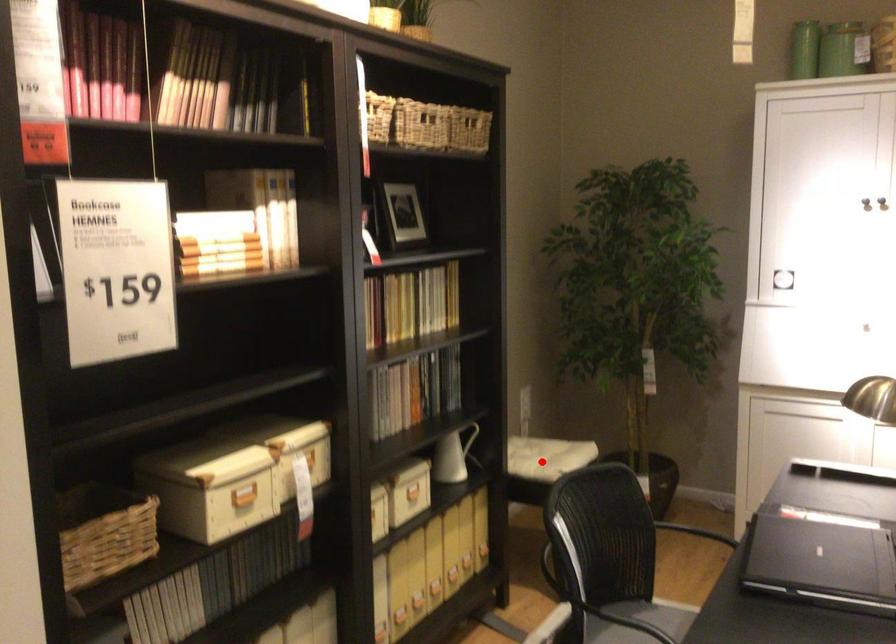
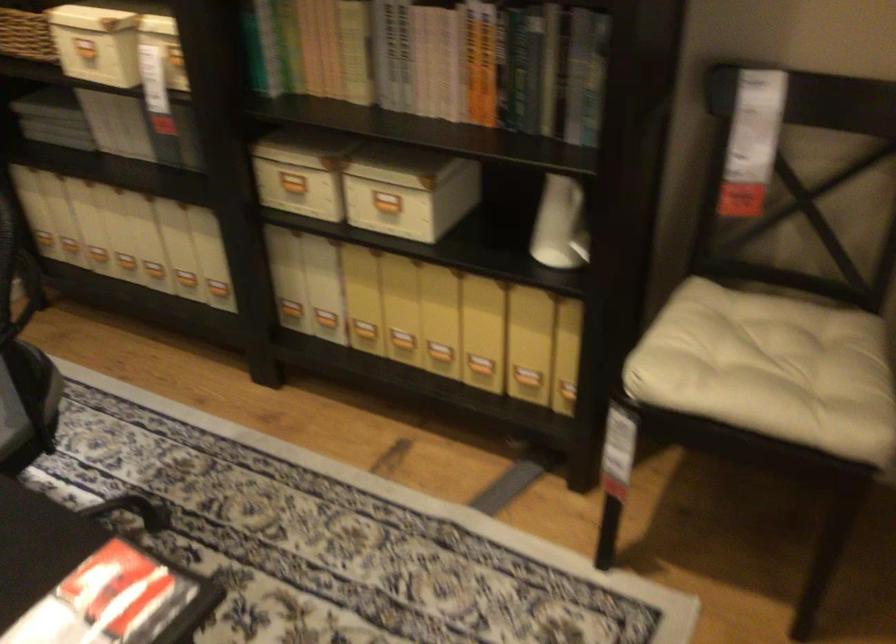
Question: I am providing you with two images of the same scene from different viewpoints. In image1, a red point is highlighted. Considering the same 3D point in image2, which of the following is correct?

Choices:
 (A) It is closer
 (B) It is farther

Answer: (A)